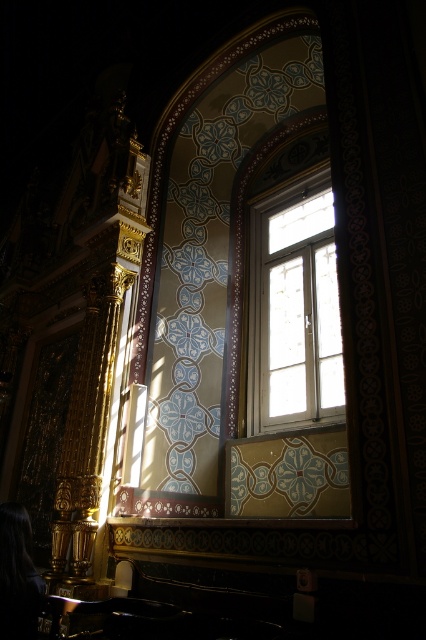
You are standing in the room and want to look out the clear glass window at center. Which direction should you turn your head to face the window from the black hair at lower left?

You should turn your head to the right to face the clear glass window at center since it is located to the right of the black hair at lower left.

You are an interior designer assessing the space for a new artwork. You have two options to hang a large painting. The first option is above the clear glass window at center, and the second is above the black hair at lower left. Considering the height of these objects, which location would allow the painting to be placed higher without obstructing the view of the window or the hair?

The clear glass window at center is much taller than the black hair at lower left, so placing the painting above the clear glass window at center would allow it to be placed higher without obstructing the view of the window or the hair.